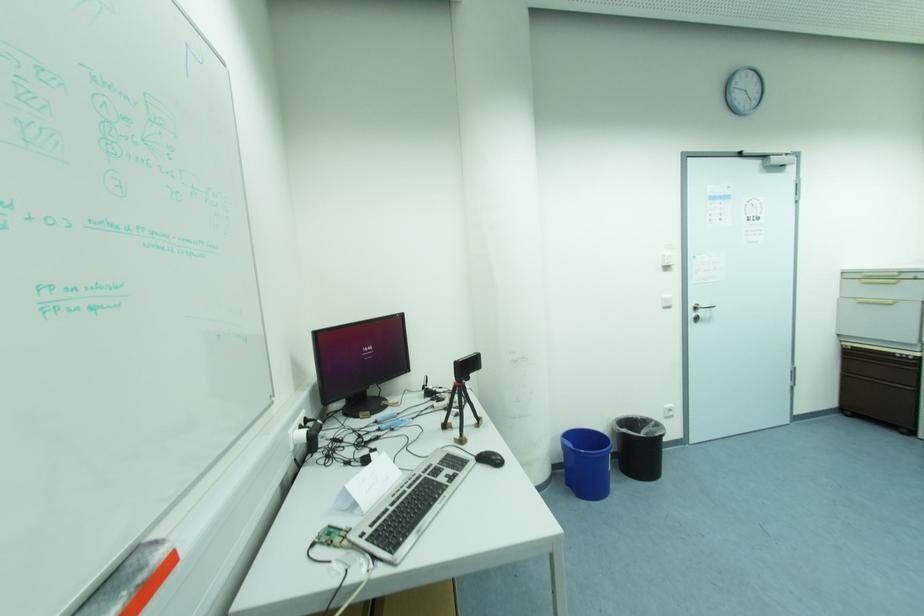
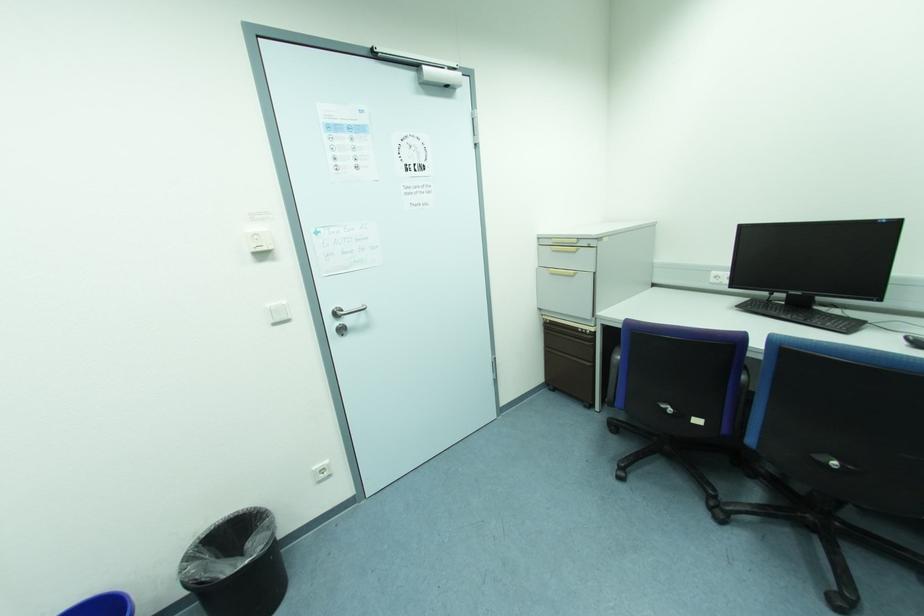
Which direction would the cameraman need to move to produce the second image?

The cameraman walked toward right, forward.